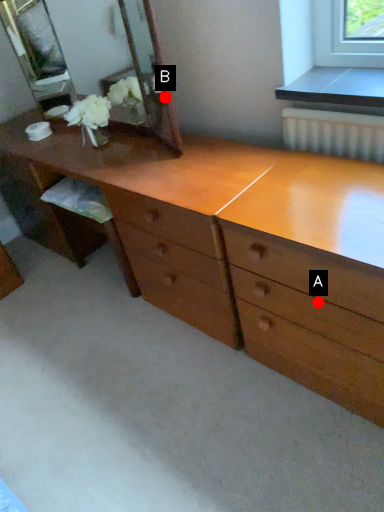
Question: Two points are circled on the image, labeled by A and B beside each circle. Which point is closer to the camera?

Choices:
 (A) A is closer
 (B) B is closer

Answer: (A)